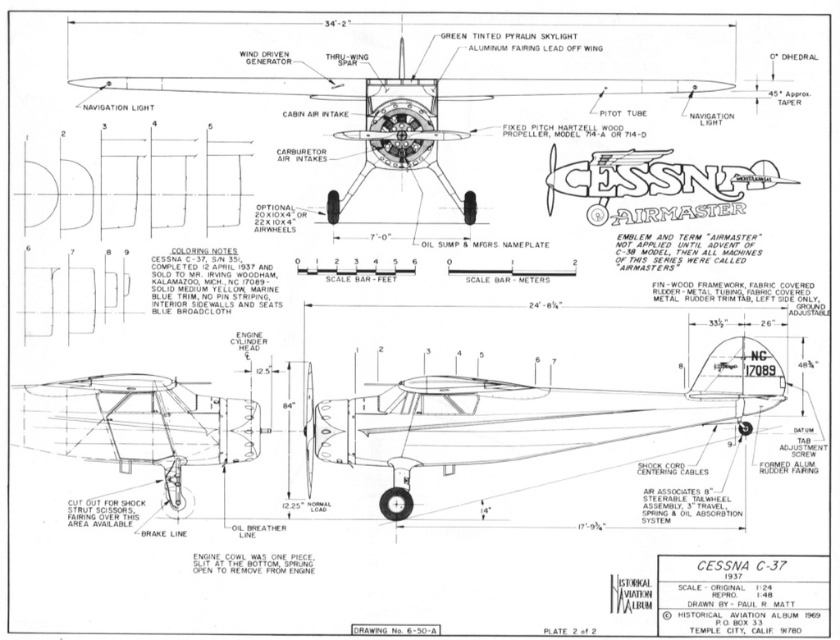
You are an aviation engineer reviewing the blueprint of the Cessna C.37 Airmaster. You notice two points labeled as point (361, 451) and point (568, 81). Which point is closer to your current position while examining the blueprint?

Point (361, 451) is closer to your current position because it is further to the viewer than point (568, 81).

You are an aircraft engineer inspecting the Cessna C 37 blueprint. You notice two propellers labeled as the matte black propeller at center and the metallic silver propeller at center. Which propeller appears closer to you in the blueprint?

The matte black propeller at center is further to the viewer than metallic silver propeller at center. Wait, but the Objects Description says the opposite. Hmm, need to check again. The user provided the Objects Description as stating the matte black is further than the metallic silver. So the answer should reflect that. The question asks which is closer. Since matte is further, the metallic silver is closer. So the answer should be the metallic silver is closer. But the user might have made a mistake in my